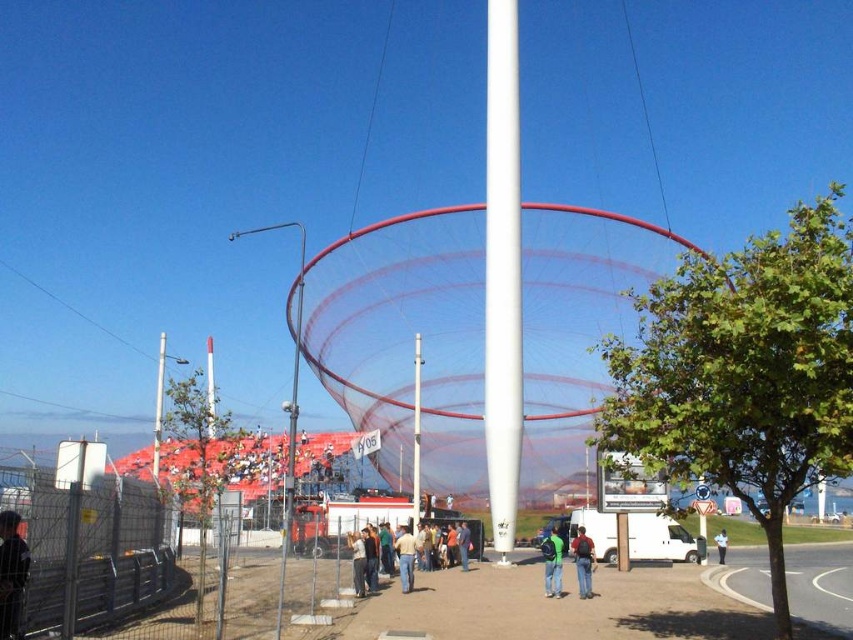
You are standing at the base of the white glossy pole at center and want to take a photo of it. If your camera can capture objects up to 30 meters away, will you be able to take a clear photo of the entire pole?

The white glossy pole at center and viewer are 33.58 meters apart from each other, so the camera cannot capture the entire pole clearly since it exceeds the 30 meters range.